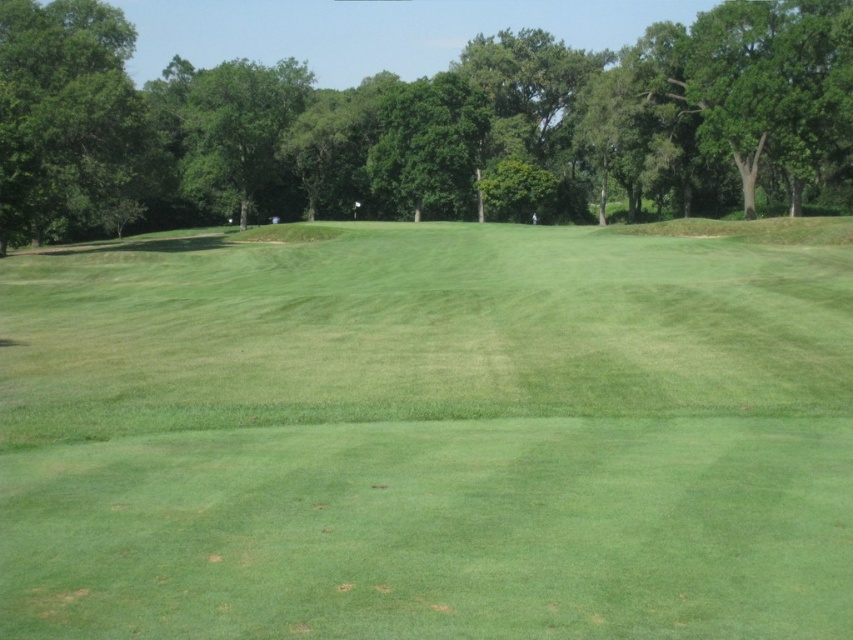
Question: Among these objects, which one is farthest from the camera?

Choices:
 (A) green grassy field at center
 (B) green leafy tree at upper center
 (C) green leafy tree at left

Answer: (B)

Question: Can you confirm if green grassy field at center is thinner than green leafy tree at left?

Choices:
 (A) yes
 (B) no

Answer: (B)

Question: Which point is closer to the camera taking this photo?

Choices:
 (A) (16, 138)
 (B) (247, 72)
 (C) (757, 600)

Answer: (C)

Question: Is green grassy field at center positioned at the back of green leafy tree at left?

Choices:
 (A) yes
 (B) no

Answer: (B)

Question: Considering the relative positions of green grassy field at center and green leafy tree at left in the image provided, where is green grassy field at center located with respect to green leafy tree at left?

Choices:
 (A) right
 (B) left

Answer: (A)

Question: Which of the following is the closest to the observer?

Choices:
 (A) (47, 346)
 (B) (26, 157)
 (C) (44, 170)

Answer: (A)